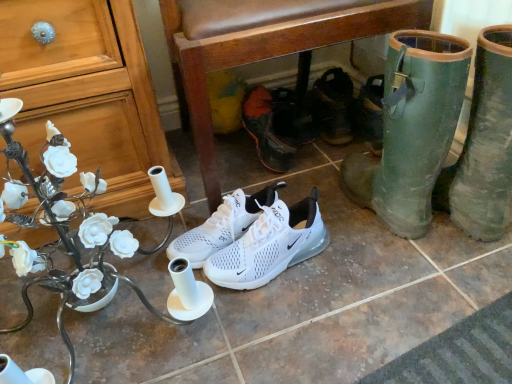
Question: Which direction should I rotate to look at white mesh sneakers at center, marked as the third footwear in a back-to-front arrangement, — up or down?

Choices:
 (A) up
 (B) down

Answer: (B)

Question: Is matte wood cabinet at left wider than black leather sandals at center, acting as the 1th footwear starting from the back?

Choices:
 (A) yes
 (B) no

Answer: (A)

Question: Is matte wood cabinet at left thinner than black leather sandals at center, placed as the fifth footwear when sorted from front to back?

Choices:
 (A) yes
 (B) no

Answer: (B)

Question: From a real-world perspective, is matte wood cabinet at left on top of black leather sandals at center, placed as the fifth footwear when sorted from front to back?

Choices:
 (A) no
 (B) yes

Answer: (B)

Question: Would you consider matte wood cabinet at left to be distant from black leather sandals at center, placed as the fifth footwear when sorted from front to back?

Choices:
 (A) yes
 (B) no

Answer: (B)

Question: From a real-world perspective, is matte wood cabinet at left below black leather sandals at center, acting as the 1th footwear starting from the back?

Choices:
 (A) yes
 (B) no

Answer: (B)

Question: Does matte wood cabinet at left come behind black leather sandals at center, placed as the fifth footwear when sorted from front to back?

Choices:
 (A) no
 (B) yes

Answer: (A)

Question: Is white mesh shoe at center, arranged as the 4th footwear when viewed from the front, completely or partially outside of black leather sandals at center, placed as the fifth footwear when sorted from front to back?

Choices:
 (A) yes
 (B) no

Answer: (A)

Question: Is white mesh shoe at center, the second footwear from the back, next to black leather sandals at center, placed as the fifth footwear when sorted from front to back, and touching it?

Choices:
 (A) no
 (B) yes

Answer: (A)

Question: Is white mesh shoe at center, arranged as the 4th footwear when viewed from the front, surrounding black leather sandals at center, acting as the 1th footwear starting from the back?

Choices:
 (A) no
 (B) yes

Answer: (A)

Question: Can you confirm if white mesh shoe at center, the second footwear from the back, is taller than black leather sandals at center, acting as the 1th footwear starting from the back?

Choices:
 (A) no
 (B) yes

Answer: (B)

Question: Is the position of white mesh shoe at center, the second footwear from the back, more distant than that of black leather sandals at center, placed as the fifth footwear when sorted from front to back?

Choices:
 (A) no
 (B) yes

Answer: (A)

Question: From the image's perspective, is white mesh shoe at center, the second footwear from the back, beneath black leather sandals at center, placed as the fifth footwear when sorted from front to back?

Choices:
 (A) yes
 (B) no

Answer: (A)

Question: Is brown leather chair at center outside of green rubber boots at lower right, marked as the fifth footwear in a back-to-front arrangement?

Choices:
 (A) no
 (B) yes

Answer: (B)